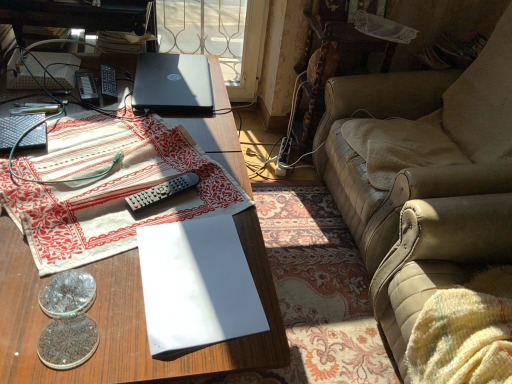
Where is `vacant area that lies between white paper at left, which is the 1th paperback book from back to front, and translucent glass coins at lower left, which is counted as the 2th coin, starting from the back`? vacant area that lies between white paper at left, which is the 1th paperback book from back to front, and translucent glass coins at lower left, which is counted as the 2th coin, starting from the back is located at coordinates (49, 165).